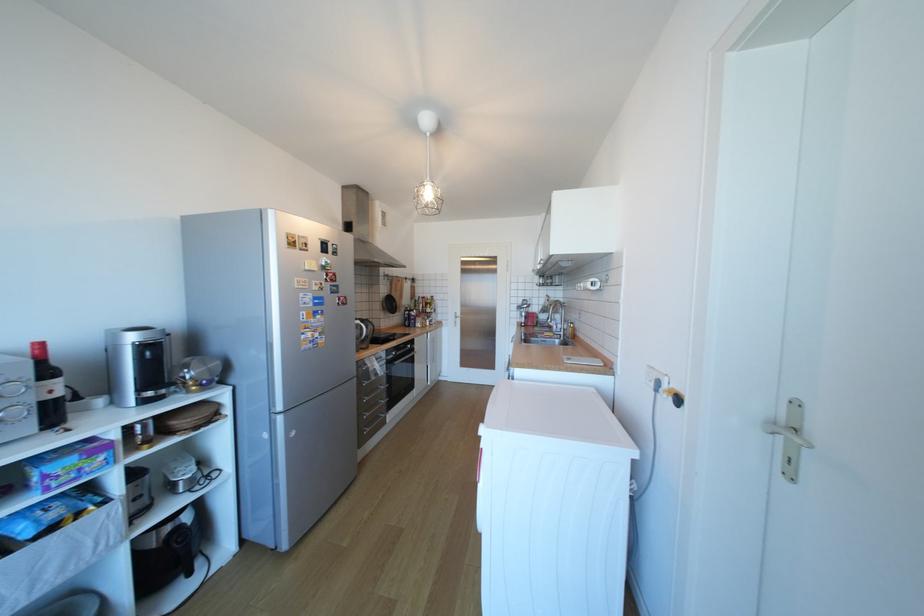
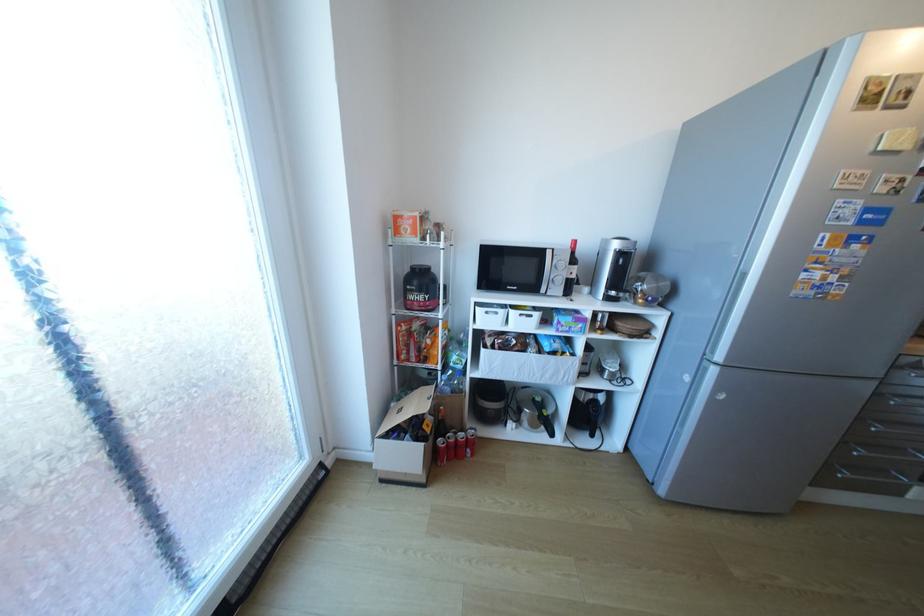
In the second image, find the point that corresponds to (369,384) in the first image.

(886, 395)